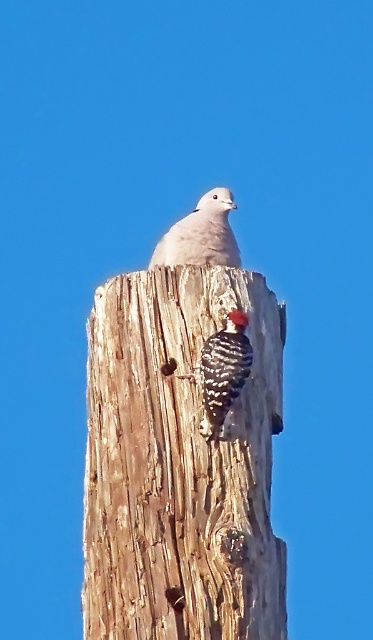
Question: Among these objects, which one is farthest from the camera?

Choices:
 (A) speckled brown woodpecker at center
 (B) wooden log at center

Answer: (A)

Question: Where is white feathered bird at center located in relation to speckled brown woodpecker at center in the image?

Choices:
 (A) below
 (B) above

Answer: (B)

Question: Which of the following is the farthest from the observer?

Choices:
 (A) wooden log at center
 (B) speckled brown woodpecker at center

Answer: (B)

Question: Which object appears farthest from the camera in this image?

Choices:
 (A) speckled brown woodpecker at center
 (B) wooden log at center
 (C) white feathered bird at center

Answer: (C)

Question: Observing the image, what is the correct spatial positioning of wooden log at center in reference to speckled brown woodpecker at center?

Choices:
 (A) above
 (B) below

Answer: (B)

Question: From the image, what is the correct spatial relationship of white feathered bird at center in relation to speckled brown woodpecker at center?

Choices:
 (A) below
 (B) above

Answer: (B)